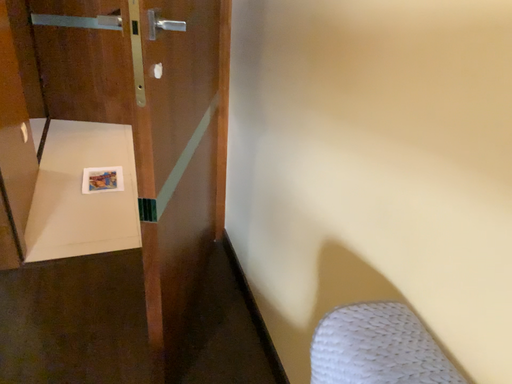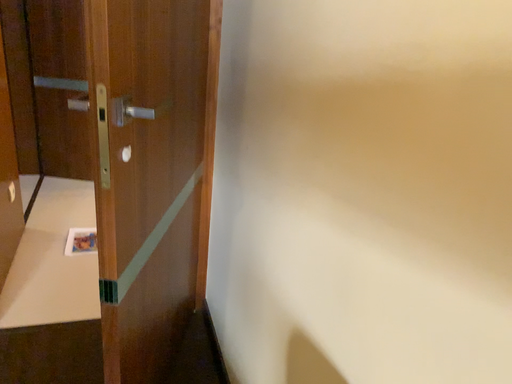
Question: How did the camera likely rotate when shooting the video?

Choices:
 (A) rotated downward
 (B) rotated upward

Answer: (B)